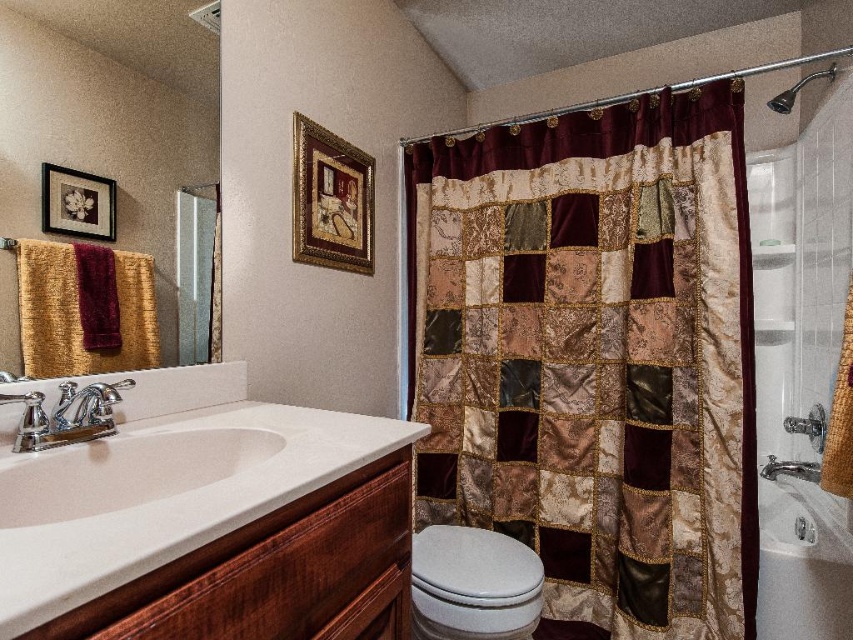
Consider the image. You are standing in the bathroom and want to wash your hands. Where is the white glossy sink at center located in relation to the mirror above the vanity?

The white glossy sink at center is located at point (125, 467), which is directly below the mirror above the vanity since the mirror spans the width of the vanity and the sink is centered.

You are organizing a bathroom inventory and need to compare the space taken up by the gold textured towel at left and the metallic silver showerhead at upper right. Which object takes up more space?

The metallic silver showerhead at upper right takes up more space than the gold textured towel at left.

You are a plumber inspecting the bathroom. You need to determine which object is shorter between the white glossy sink at center and the metallic silver showerhead at upper right. Based on the scene, which one is shorter?

The white glossy sink at center is shorter than the metallic silver showerhead at upper right.